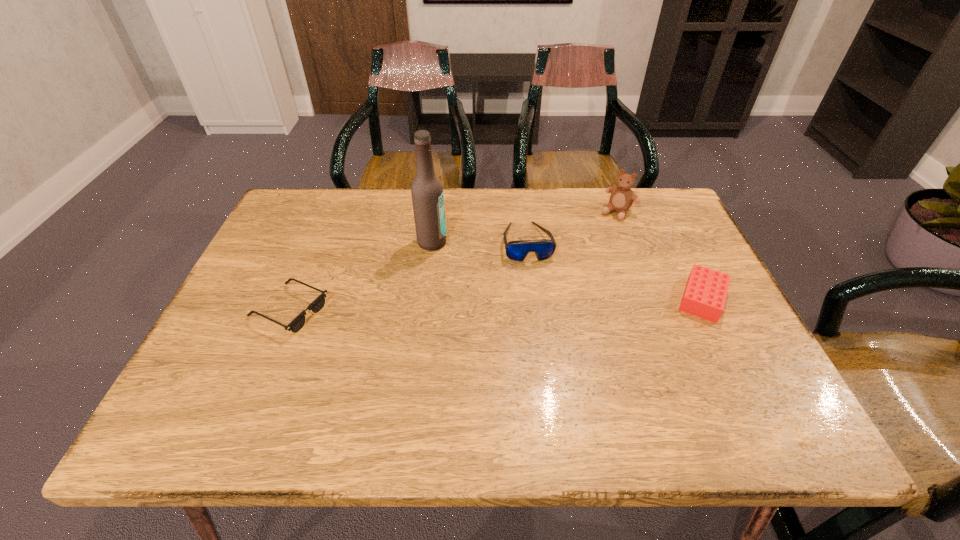
Identify the location of blank space at the left edge of the desktop. (321, 244).

Where is `vacant area at the right edge`? This screenshot has width=960, height=540. vacant area at the right edge is located at coordinates (684, 328).

Where is `vacant space at the far left corner`? The image size is (960, 540). vacant space at the far left corner is located at coordinates click(x=320, y=217).

You are a GUI agent. You are given a task and a screenshot of the screen. Output one action in this format:
    pyautogui.click(x=<x>, y=<y>)
    Task: Click on the blank space at the near left corner
    The height and width of the screenshot is (540, 960).
    Given the screenshot: What is the action you would take?
    pyautogui.click(x=237, y=369)

I want to click on free space at the far right corner of the desktop, so click(641, 236).

Locate an element on the screen. Image resolution: width=960 pixels, height=540 pixels. free space between the fourth object from left to right and the right sunglasses is located at coordinates (572, 227).

Find the location of a particular element. unoccupied position between the teddy bear and the shorter sunglasses is located at coordinates (454, 261).

The image size is (960, 540). I want to click on vacant area between the nearer sunglasses and the second shortest object, so click(x=495, y=305).

What are the coordinates of `free space between the Lego and the teddy bear` in the screenshot? It's located at (660, 255).

Locate an element on the screen. This screenshot has height=540, width=960. free point between the Lego and the second object from left to right is located at coordinates (567, 271).